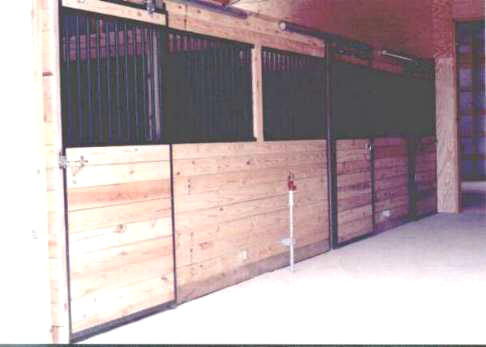
This screenshot has width=486, height=347. In order to click on top wood strip directly under bars in this screenshot , I will do `click(127, 151)`, `click(229, 145)`, `click(362, 143)`, `click(391, 141)`, `click(432, 139)`.